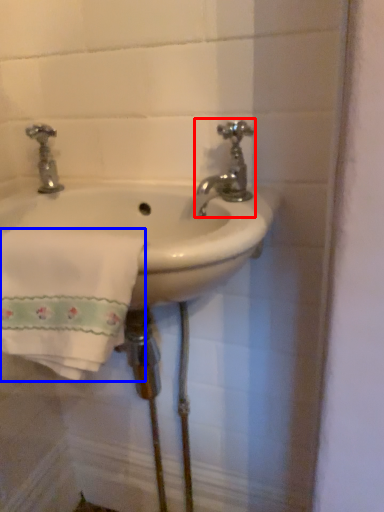
Question: Which object appears closest to the camera in this image, tap (highlighted by a red box) or bath towel (highlighted by a blue box)?

Choices:
 (A) tap
 (B) bath towel

Answer: (B)